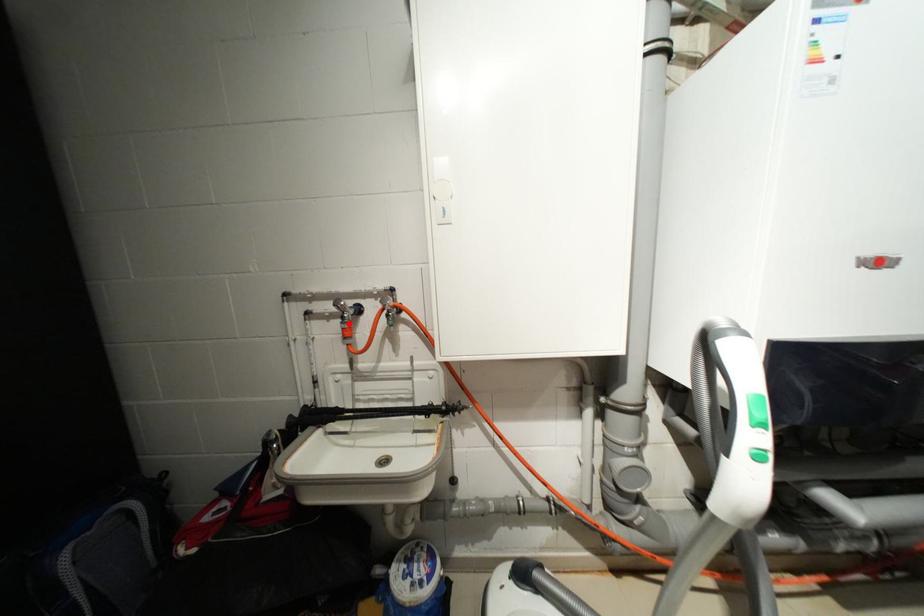
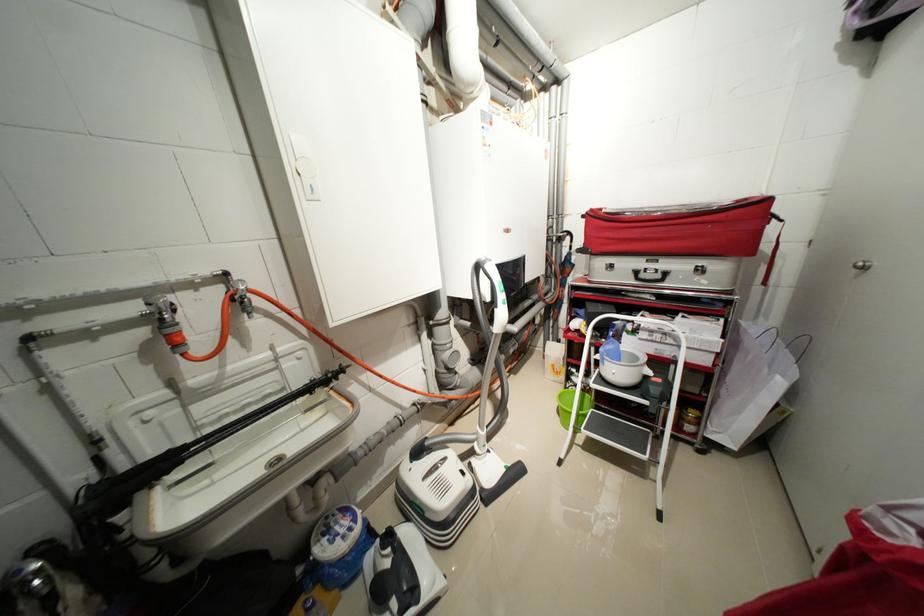
The point at the highlighted location is marked in the first image. Where is the corresponding point in the second image?

(167, 329)